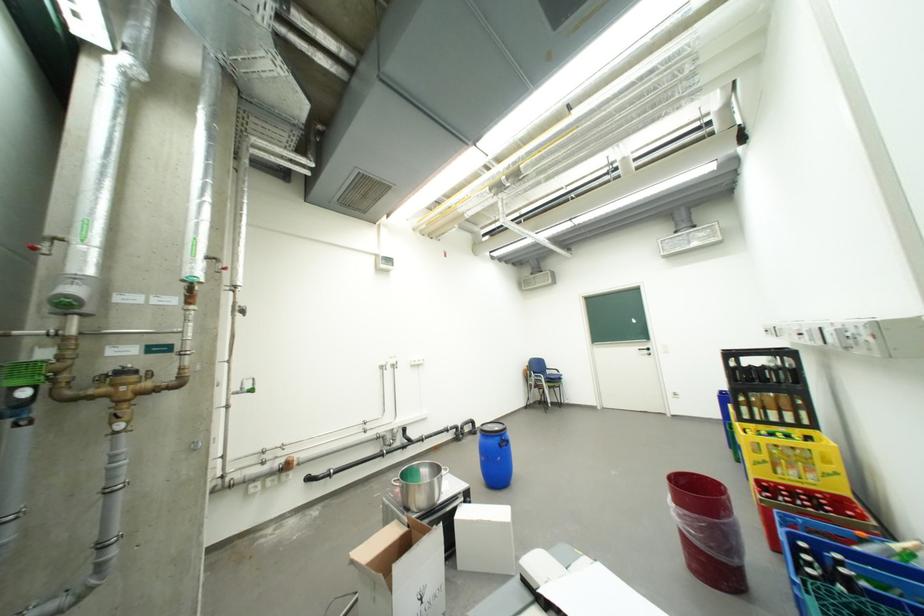
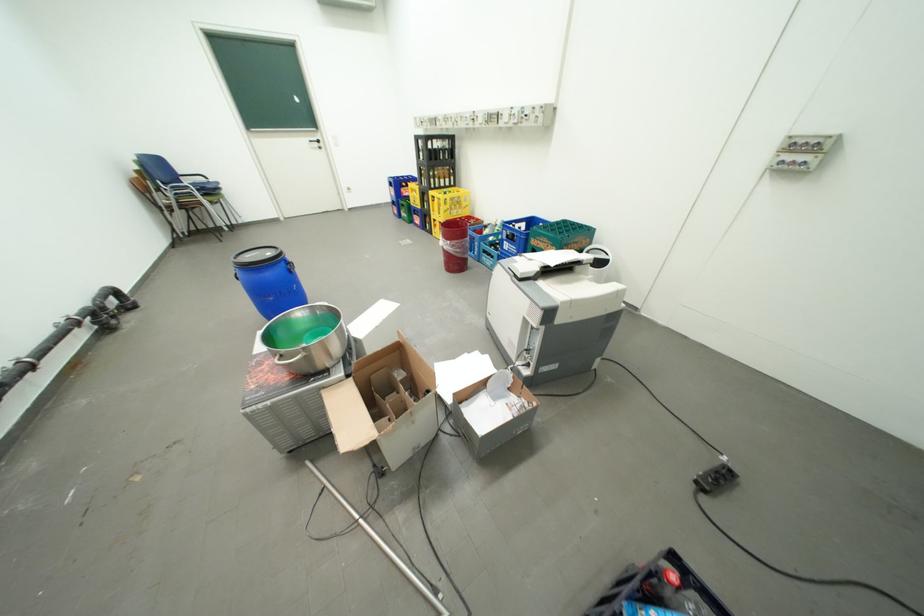
Where in the second image is the point corresponding to point 507,438 from the first image?

(290, 262)